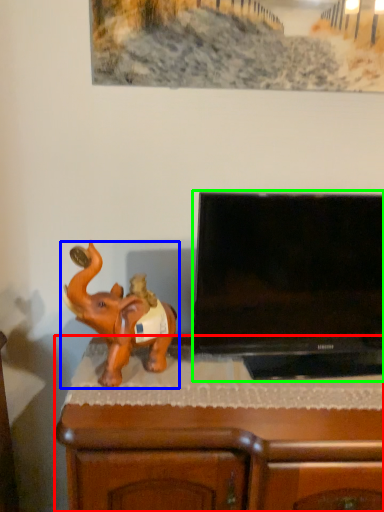
Question: Which is farther away from furniture (highlighted by a red box)? elephant (highlighted by a blue box) or television (highlighted by a green box)?

Choices:
 (A) elephant
 (B) television

Answer: (B)